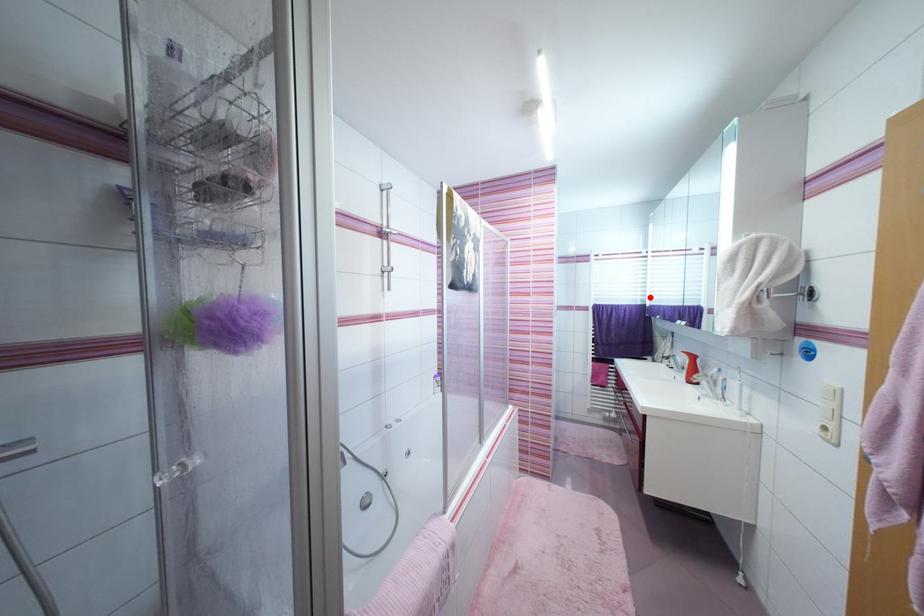
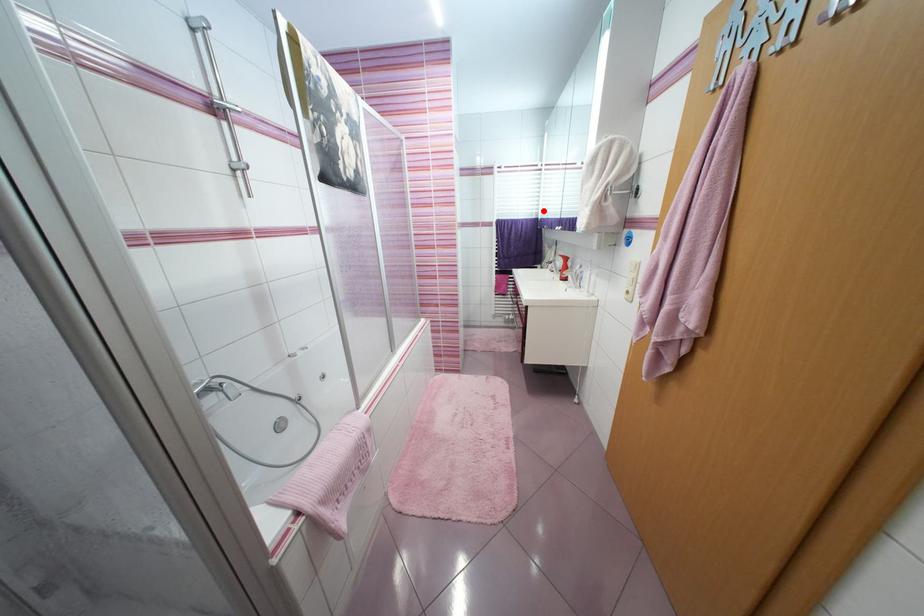
I am providing you with two images of the same scene from different viewpoints. A red point is marked on the first image and another point is marked on the second image. Is the red point in image1 aligned with the point shown in image2?

Yes